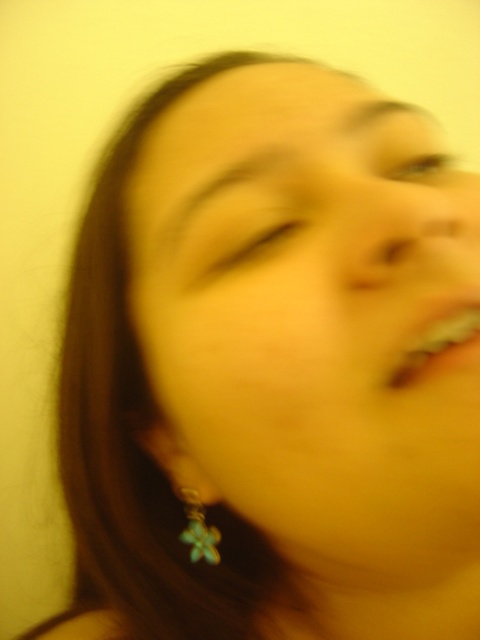
Does point (464, 360) come closer to viewer compared to point (193, 557)?

Yes, point (464, 360) is closer to viewer.

This screenshot has width=480, height=640. Find the location of `matte pink lips at center`. matte pink lips at center is located at coordinates (436, 346).

Does point (431, 326) come behind point (197, 518)?

That is False.

At what (x,y) coordinates should I click in order to perform the action: click on matte pink lips at center. Please return your answer as a coordinate pair (x, y). Looking at the image, I should click on (436, 346).

Does matte yellow eye at center have a greater width compared to matte pink lips at center?

Indeed, matte yellow eye at center has a greater width compared to matte pink lips at center.

This screenshot has width=480, height=640. Describe the element at coordinates (233, 246) in the screenshot. I see `matte yellow eye at center` at that location.

Where is `matte yellow eye at center`? This screenshot has width=480, height=640. matte yellow eye at center is located at coordinates (233, 246).

What do you see at coordinates (233, 246) in the screenshot?
I see `matte yellow eye at center` at bounding box center [233, 246].

Locate an element on the screen. The image size is (480, 640). matte yellow eye at center is located at coordinates (233, 246).

This screenshot has height=640, width=480. Describe the element at coordinates (233, 246) in the screenshot. I see `matte yellow eye at center` at that location.

Locate an element on the screen. matte yellow eye at center is located at coordinates (233, 246).